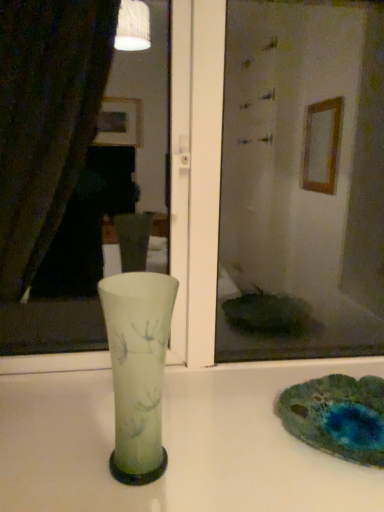
Where is `free region under transparent glass mirror at center (from a real-world perspective)`? free region under transparent glass mirror at center (from a real-world perspective) is located at coordinates (177, 399).